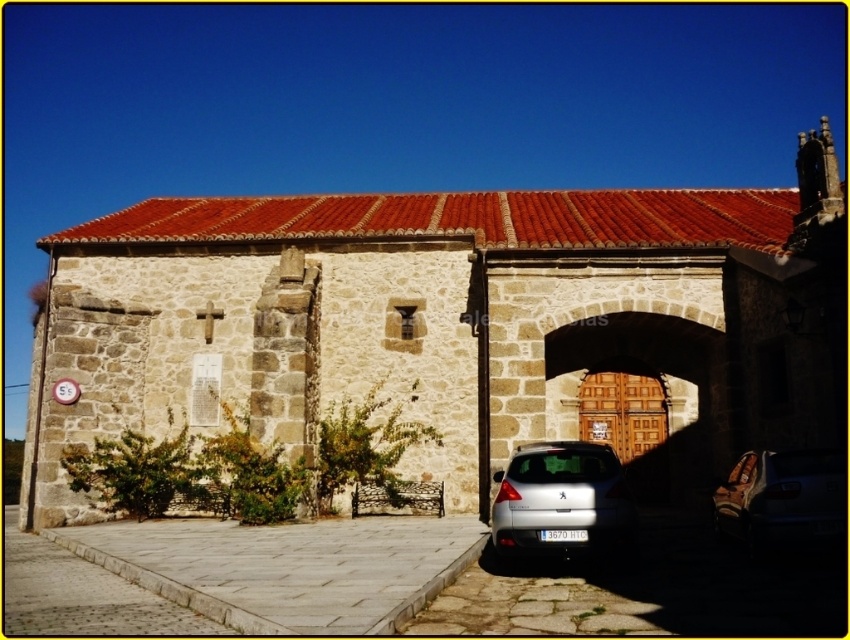
Question: Is satin silver car at lower center wider than metallic silver car at center?

Choices:
 (A) no
 (B) yes

Answer: (B)

Question: Is satin silver car at lower center to the left of metallic silver car at center from the viewer's perspective?

Choices:
 (A) no
 (B) yes

Answer: (B)

Question: Is satin silver car at lower center below metallic silver car at center?

Choices:
 (A) yes
 (B) no

Answer: (B)

Question: Which point is farther to the camera?

Choices:
 (A) metallic silver car at center
 (B) satin silver car at lower center

Answer: (B)